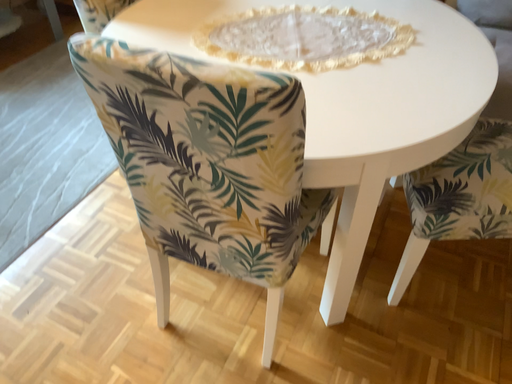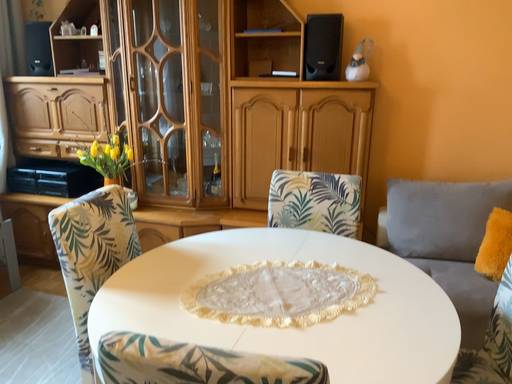
Question: How did the camera likely rotate when shooting the video?

Choices:
 (A) rotated left
 (B) rotated right

Answer: (B)